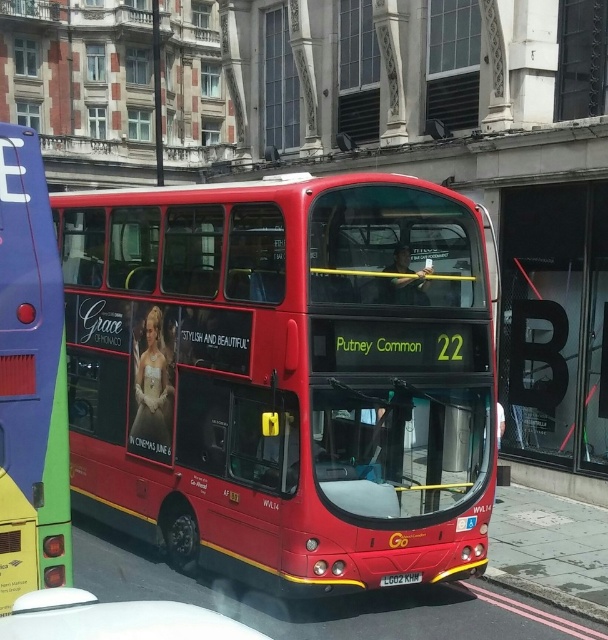
Is shiny red bus at center smaller than white plastic license plate at center?

No, shiny red bus at center is not smaller than white plastic license plate at center.

Does shiny red bus at center appear under white plastic license plate at center?

No.

This screenshot has height=640, width=608. Identify the location of shiny red bus at center. (283, 374).

At what (x,y) coordinates should I click in order to perform the action: click on shiny red bus at center. Please return your answer as a coordinate pair (x, y). Looking at the image, I should click on (283, 374).

Measure the distance from matte red bus at center to white plastic license plate at center.

3.25 meters

Where is `matte red bus at center`? This screenshot has height=640, width=608. matte red bus at center is located at coordinates (30, 380).

The width and height of the screenshot is (608, 640). I want to click on matte red bus at center, so click(30, 380).

Can you confirm if shiny red bus at center is positioned above matte red bus at center?

Actually, shiny red bus at center is below matte red bus at center.

Locate an element on the screen. shiny red bus at center is located at coordinates (283, 374).

Is point (114, 518) positioned before point (7, 440)?

No, it is not.

You are a GUI agent. You are given a task and a screenshot of the screen. Output one action in this format:
    pyautogui.click(x=<x>, y=<y>)
    Task: Click on the shiny red bus at center
    The width and height of the screenshot is (608, 640).
    Given the screenshot: What is the action you would take?
    pyautogui.click(x=283, y=374)